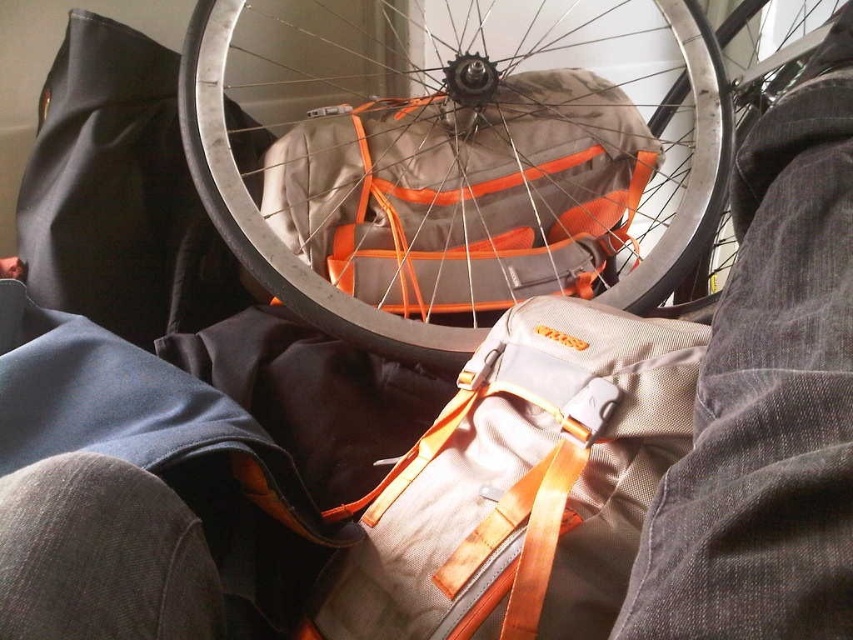
You are trying to locate the metallic silver wheel at center in the image. What are its coordinates?

The metallic silver wheel at center is located at coordinates point (456, 156).

You are standing in a room where a bicycle wheel is resting on two backpacks. You notice gray fabric pants at lower right and a shiny metallic rim at center. Which object is closer to you?

The gray fabric pants at lower right is closer to you because it is in front of the shiny metallic rim at center.